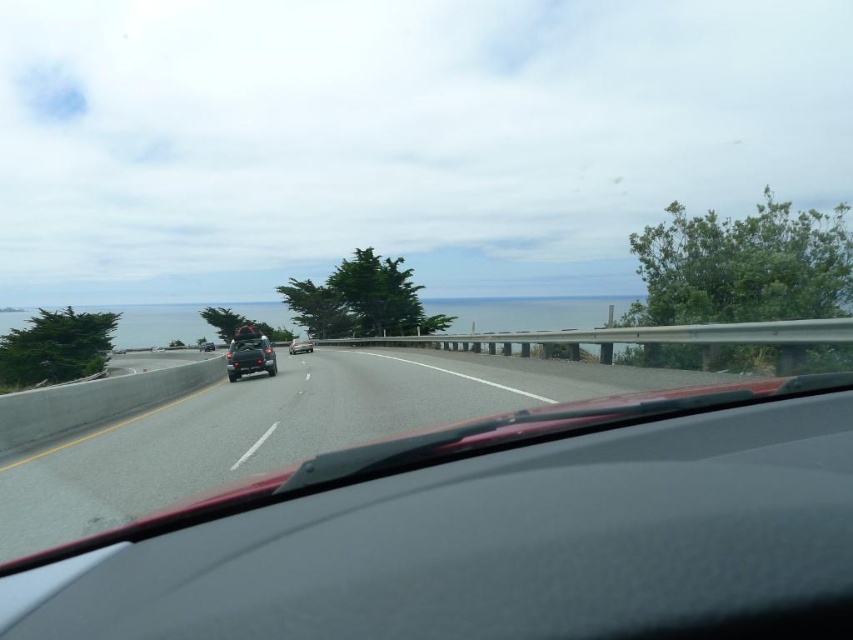
You are driving a car that is 15 feet long. You want to know if your car can fit entirely within the visible portion of the asphalt road at center. The visible portion of the road extends from the front of your car to the horizon. Can your car fit within this visible portion?

The asphalt road at center is 209.31 feet away from the camera. Since your car is only 15 feet long, it can easily fit within the visible portion of the asphalt road at center.

You are sitting in the driver seat of the vehicle and want to know which of the two points, point (250,369) or point (289,352), is closer to you. Based on the scene description, which point is nearer?

Point (250,369) is closer to the viewer than point (289,352).